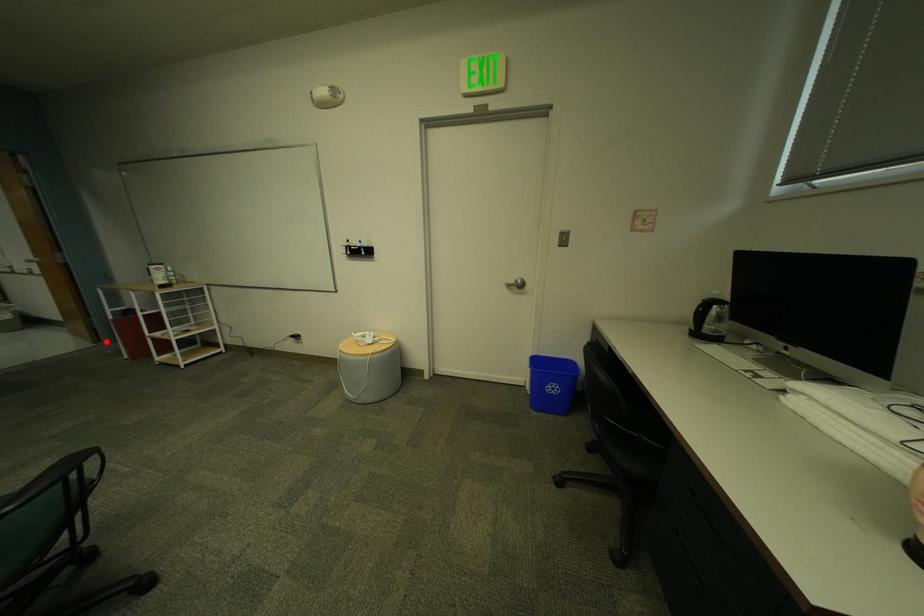
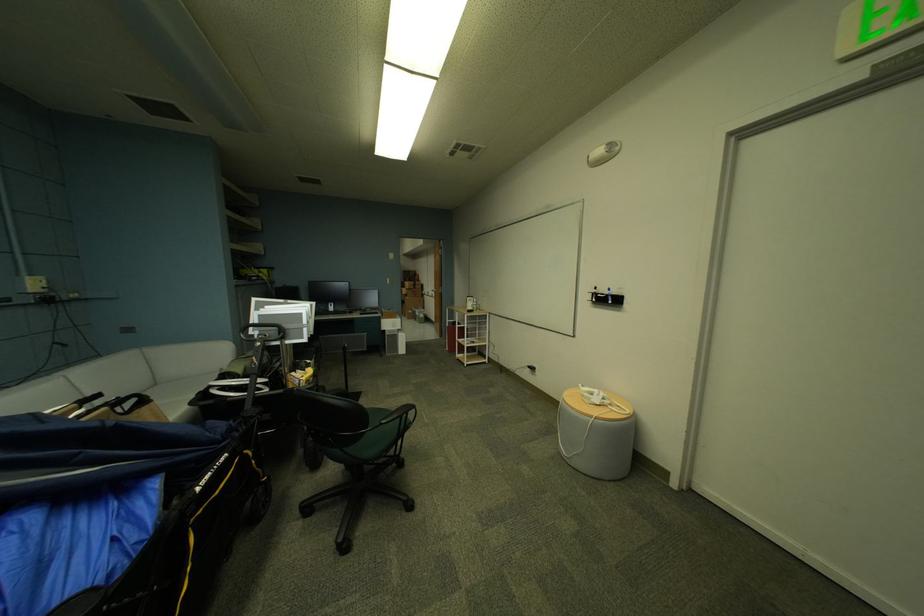
Locate, in the second image, the point that corresponds to the highlighted location in the first image.

(450, 337)